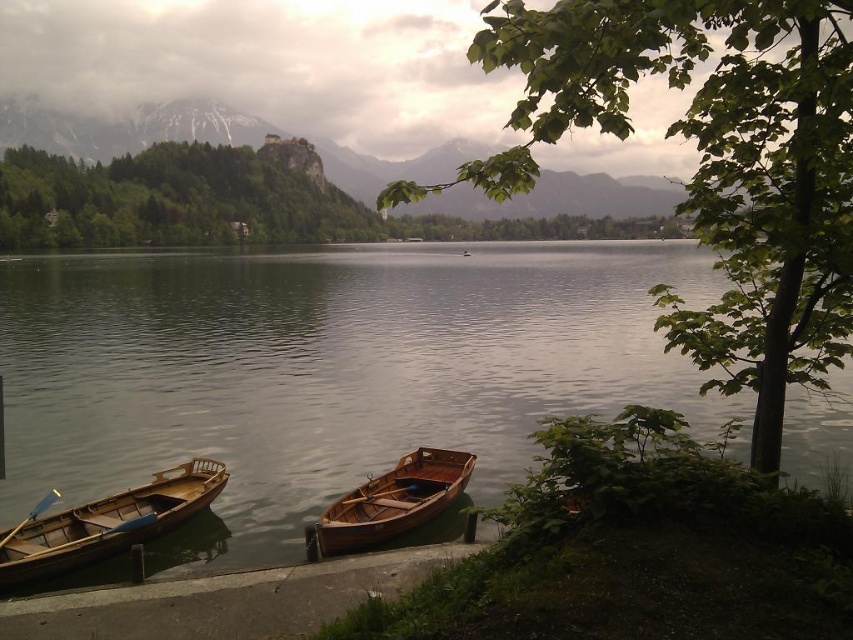
Question: Which point is closer to the camera?

Choices:
 (A) smooth water at center
 (B) green leafy tree at lower right

Answer: (B)

Question: Can you confirm if smooth water at center is wider than wooden dock at lower left?

Choices:
 (A) no
 (B) yes

Answer: (B)

Question: Can you confirm if wooden dock at lower left is smaller than wooden canoe at lower left?

Choices:
 (A) yes
 (B) no

Answer: (A)

Question: Among these points, which one is nearest to the camera?

Choices:
 (A) (456, 477)
 (B) (782, 170)
 (C) (424, 576)

Answer: (B)

Question: Observing the image, what is the correct spatial positioning of smooth water at center in reference to wooden canoe at lower left?

Choices:
 (A) below
 (B) above

Answer: (B)

Question: Which point is farther from the camera taking this photo?

Choices:
 (A) (7, 616)
 (B) (354, 340)

Answer: (B)